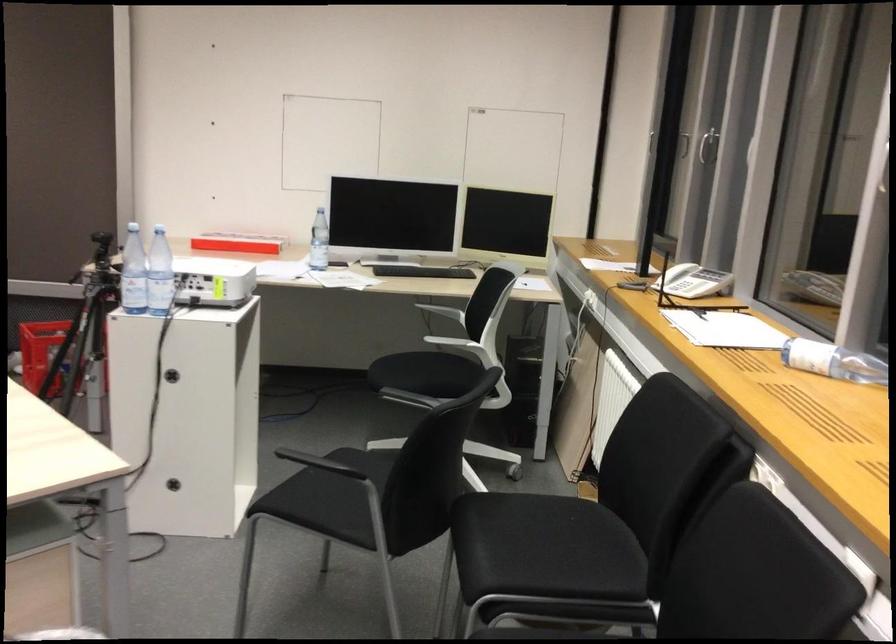
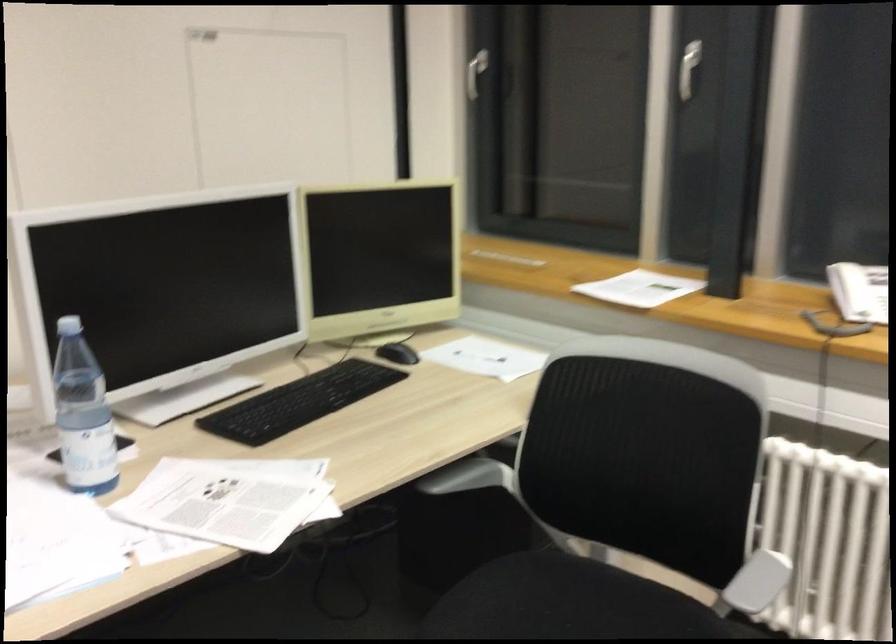
Locate, in the second image, the point that corresponds to (x=485, y=265) in the first image.

(398, 353)